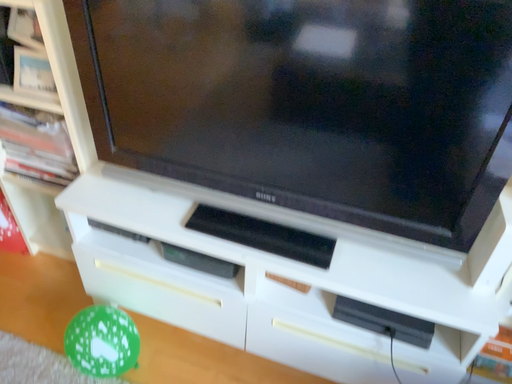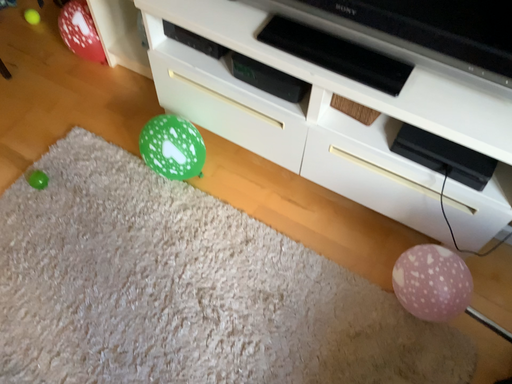
Question: Which way did the camera rotate in the video?

Choices:
 (A) rotated downward
 (B) rotated upward

Answer: (A)